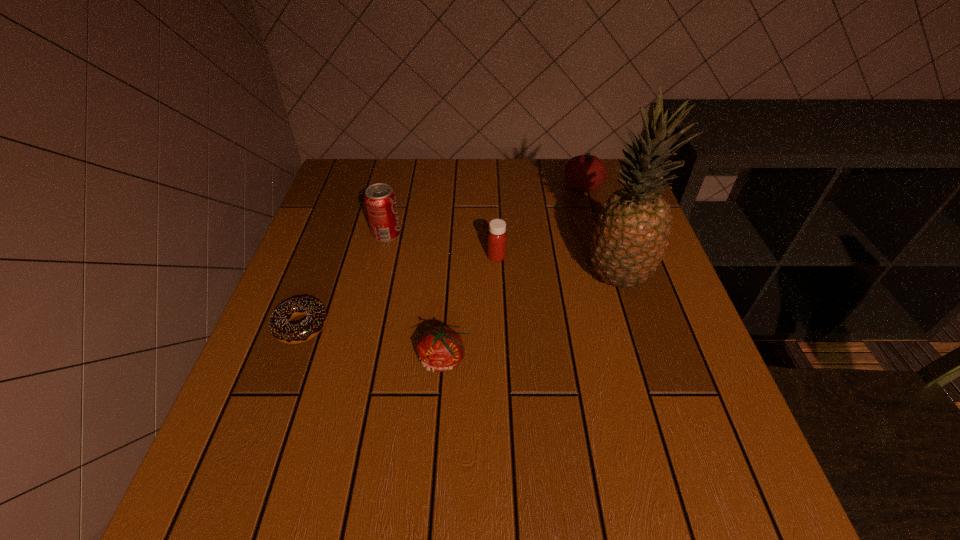
I want to click on pineapple, so click(x=628, y=243).

This screenshot has width=960, height=540. Identify the location of the fifth shortest object. (380, 200).

The height and width of the screenshot is (540, 960). In order to click on the fifth object from right to left in this screenshot , I will do `click(380, 200)`.

Where is `the farther tomato`? This screenshot has width=960, height=540. the farther tomato is located at coordinates (587, 172).

This screenshot has height=540, width=960. In order to click on the taller tomato in this screenshot , I will do `click(587, 172)`.

Where is `medicine`? This screenshot has height=540, width=960. medicine is located at coordinates (497, 238).

Where is `the second shortest object`? the second shortest object is located at coordinates (440, 349).

The image size is (960, 540). In order to click on the fourth object from right to left in this screenshot , I will do `click(440, 349)`.

Find the location of a particular element. the leftmost object is located at coordinates (279, 323).

Image resolution: width=960 pixels, height=540 pixels. In order to click on the shortest object in this screenshot , I will do `click(279, 323)`.